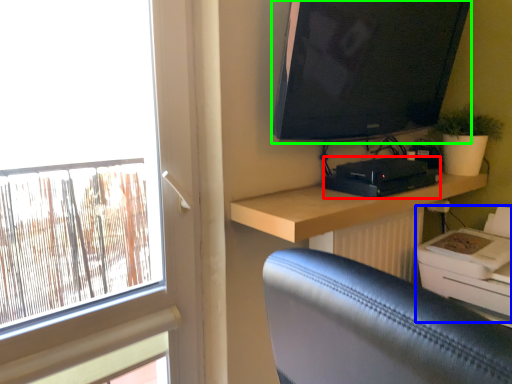
Question: Which object is the closest to the equipment (highlighted by a red box)? Choose among these: printer (highlighted by a blue box) or television (highlighted by a green box).

Choices:
 (A) printer
 (B) television

Answer: (B)